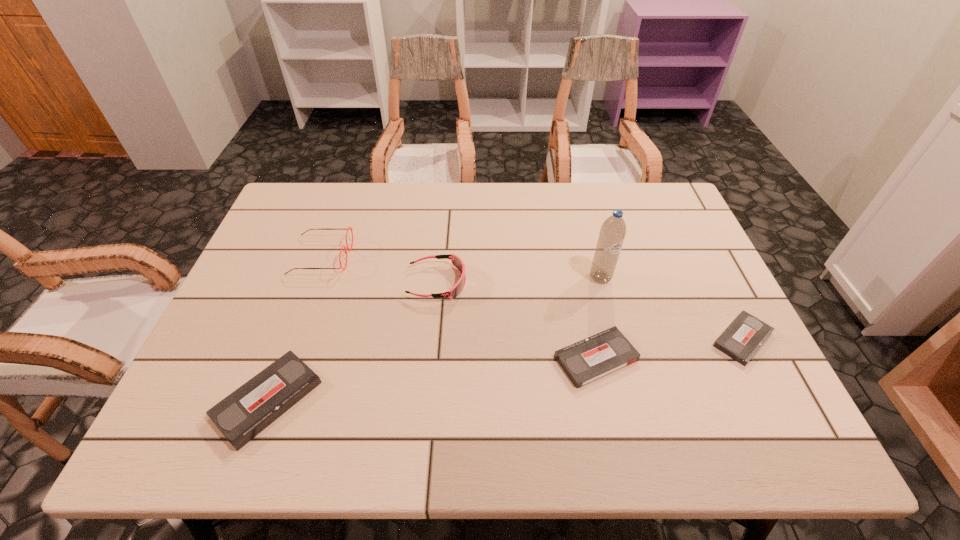
If equal spacing is the goal by inserting an additional videotape among them, please point out a vacant space for this new videotape. Please provide its 2D coordinates. Your answer should be formatted as a tuple, i.e. [(x, y)], where the tuple contains the x and y coordinates of a point satisfying the conditions above.

[(438, 379)]